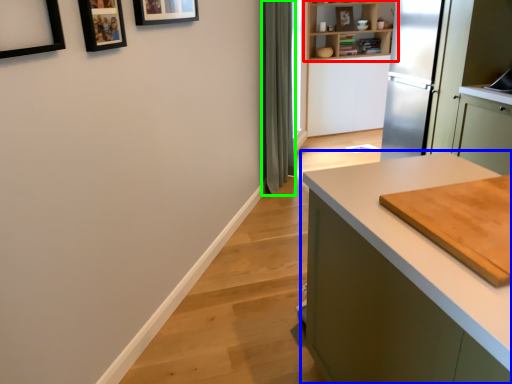
Question: Which object is the farthest from shelf (highlighted by a red box)? Choose among these: countertop (highlighted by a blue box) or curtain (highlighted by a green box).

Choices:
 (A) countertop
 (B) curtain

Answer: (A)